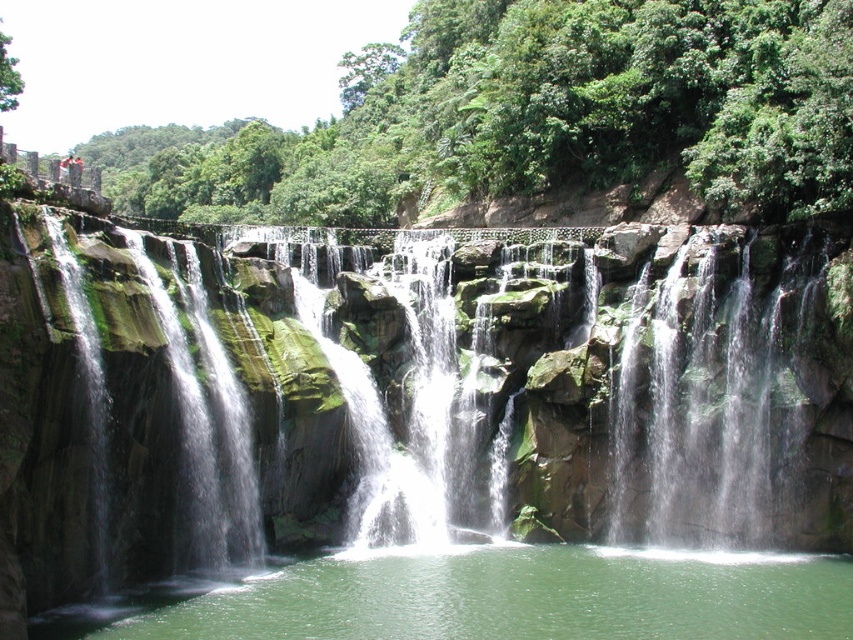
Looking at this image, you are standing at the edge of the waterfall and want to place a small decorative rock on the green mossy rocks at center so that it can be seen from the green liquid water at center. Is the placement possible?

The green mossy rocks at center is in front of green liquid water at center, so placing the small decorative rock on the green mossy rocks at center will make it visible from the green liquid water at center since it is positioned in front of it.

You are standing at the edge of the waterfall and see the green mossy rocks at center and the green liquid water at center. Which object is located above the other?

The green mossy rocks at center are positioned over the green liquid water at center.

You are standing at the edge of the waterfall and see the green mossy rocks at center and the green liquid water at center. Which object is positioned to the left?

The green mossy rocks at center is to the left of the green liquid water at center, so the green mossy rocks at center is positioned to the left.